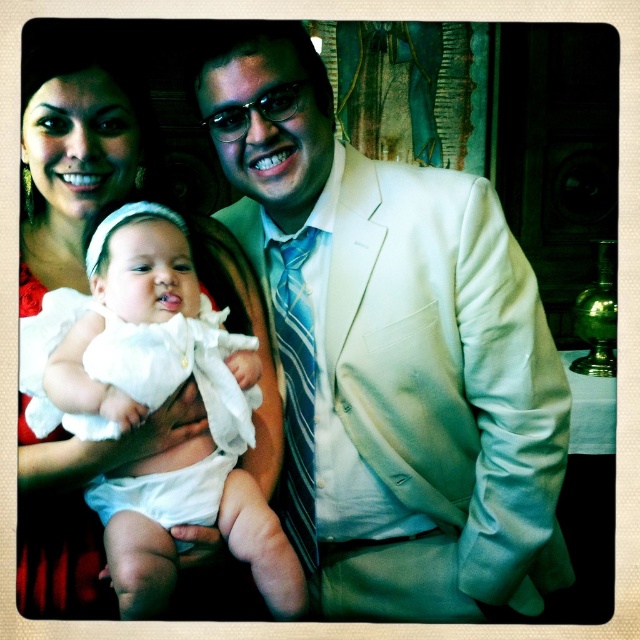
Looking at this image, in the scene, there is a white satin suit at center and a white clothed baby at center. Which object is taller?

The white satin suit at center is taller than the white clothed baby at center.

You are standing in the room and see two points marked in the image. The first point is at coordinates point (134, 234) and the second is at point (74, 561). From your perspective, which point is closer to you?

Point (74, 561) is closer to you because it is in front of point (134, 234).